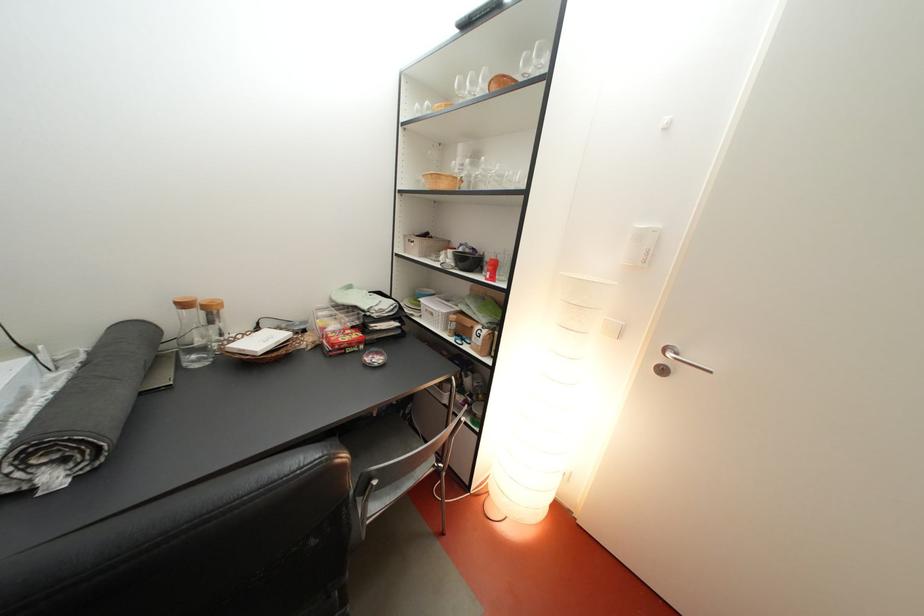
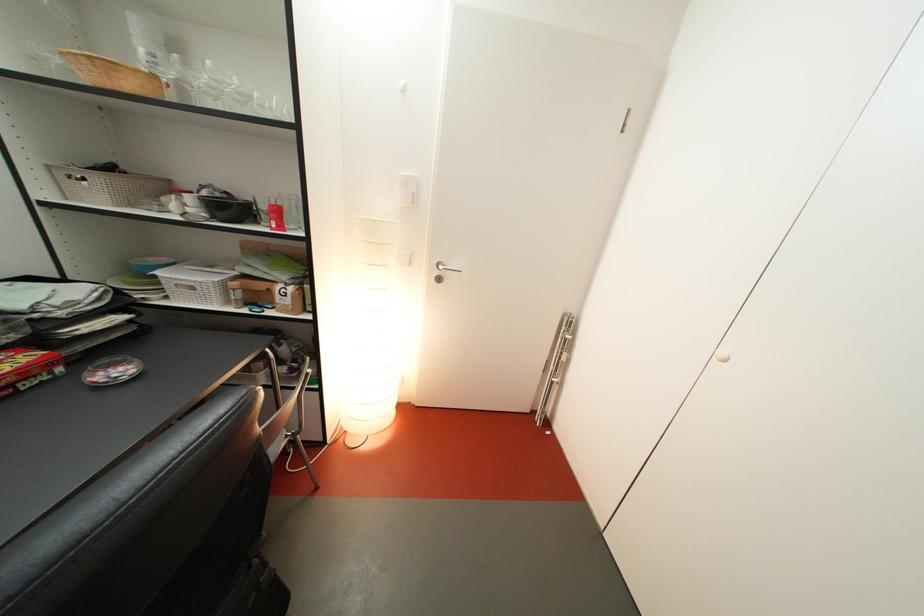
Find the pixel in the second image that matches (x=471, y=256) in the first image.

(216, 200)